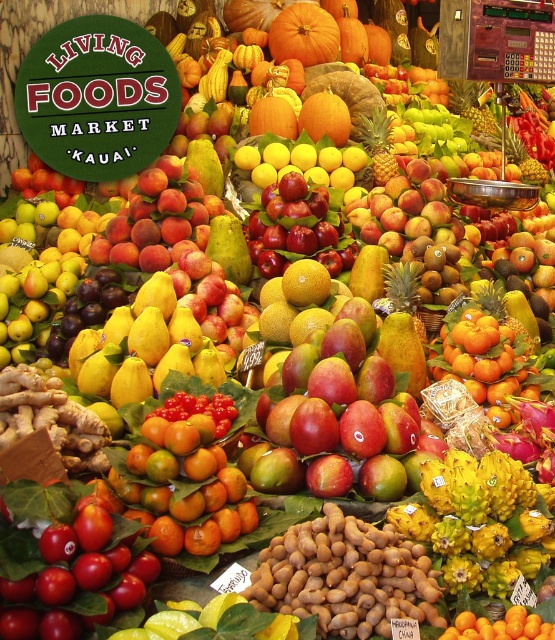
Question: Is shiny orange tangerines at center positioned behind shiny red apple at center?

Choices:
 (A) yes
 (B) no

Answer: (B)

Question: Which point is closer to the camera?

Choices:
 (A) shiny red apple at center
 (B) shiny red apples at center

Answer: (B)

Question: Considering the relative positions of shiny red apples at center and shiny red apple at center in the image provided, where is shiny red apples at center located with respect to shiny red apple at center?

Choices:
 (A) above
 (B) below

Answer: (B)

Question: Does shiny orange tangerines at center lie in front of shiny red apple at center?

Choices:
 (A) no
 (B) yes

Answer: (B)

Question: Which point is closer to the camera?

Choices:
 (A) (393, 234)
 (B) (246, 509)
 (C) (291, 196)

Answer: (B)

Question: Which object appears farthest from the camera in this image?

Choices:
 (A) shiny red apples at center
 (B) shiny orange tangerines at center
 (C) shiny red apple at center

Answer: (C)